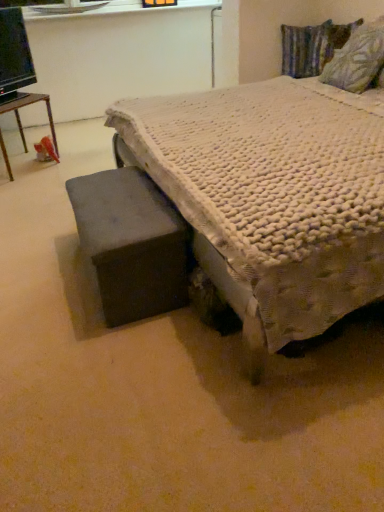
Measure the distance between point (145, 228) and camera.

They are 1.61 meters apart.

Describe the element at coordinates (357, 59) in the screenshot. I see `textured fabric pillow at upper right, the 1th pillow in the front-to-back sequence` at that location.

What do you see at coordinates (272, 197) in the screenshot?
I see `white textured bed at center` at bounding box center [272, 197].

What do you see at coordinates (306, 49) in the screenshot? Image resolution: width=384 pixels, height=512 pixels. I see `textured multicolored pillow at upper right, the first pillow positioned from the back` at bounding box center [306, 49].

Find the location of a particular element. This screenshot has height=512, width=384. dark gray fabric ottoman at lower left is located at coordinates (131, 243).

Based on the photo, considering the relative sizes of white textured bed at center and textured fabric pillow at upper right, the 1th pillow from the bottom, in the image provided, is white textured bed at center thinner than textured fabric pillow at upper right, the 1th pillow from the bottom,?

No.

Considering the points (170, 170) and (358, 83), which point is in front, point (170, 170) or point (358, 83)?

The point (170, 170) is closer to the camera.

Based on the photo, is white textured bed at center in contact with textured fabric pillow at upper right, the second pillow viewed from the back?

There is a gap between white textured bed at center and textured fabric pillow at upper right, the second pillow viewed from the back.

From the picture: From the image's perspective, which one is positioned lower, dark gray fabric ottoman at lower left or textured fabric pillow at upper right, the second pillow viewed from the back?

dark gray fabric ottoman at lower left.

Are dark gray fabric ottoman at lower left and textured fabric pillow at upper right, arranged as the 2th pillow when viewed from the top, located far from each other?

Indeed, dark gray fabric ottoman at lower left is not near textured fabric pillow at upper right, arranged as the 2th pillow when viewed from the top.

Image resolution: width=384 pixels, height=512 pixels. Identify the location of swivel chair below the textured fabric pillow at upper right, the 1th pillow from the bottom (from a real-world perspective). [x=131, y=243].

From a real-world perspective, who is located lower, dark gray fabric ottoman at lower left or textured fabric pillow at upper right, the 1th pillow in the front-to-back sequence?

dark gray fabric ottoman at lower left, from a real-world perspective.

How many degrees apart are the facing directions of black glossy computer monitor at upper left and textured multicolored pillow at upper right, the 2th pillow positioned from the front?

They differ by 58.6 degrees in their facing directions.

In the scene shown: From a real-world perspective, which object stands above the other?

In real-world perspective, black glossy computer monitor at upper left is above.

Which is behind, black glossy computer monitor at upper left or textured multicolored pillow at upper right, the first pillow positioned from the back?

textured multicolored pillow at upper right, the first pillow positioned from the back, is further from the camera.

Looking at this image, how far apart are black glossy computer monitor at upper left and textured multicolored pillow at upper right, the first pillow positioned from the back?

black glossy computer monitor at upper left is 2.20 meters from textured multicolored pillow at upper right, the first pillow positioned from the back.

Is there a large distance between textured fabric pillow at upper right, the second pillow viewed from the back, and black glossy computer monitor at upper left?

Absolutely, textured fabric pillow at upper right, the second pillow viewed from the back, is distant from black glossy computer monitor at upper left.

Which object is closer to the camera taking this photo, textured fabric pillow at upper right, arranged as the 2th pillow when viewed from the top, or black glossy computer monitor at upper left?

textured fabric pillow at upper right, arranged as the 2th pillow when viewed from the top, is closer to the camera.

From the image's perspective, is textured fabric pillow at upper right, arranged as the 2th pillow when viewed from the top, under black glossy computer monitor at upper left?

Indeed, from the image's perspective, textured fabric pillow at upper right, arranged as the 2th pillow when viewed from the top, is shown beneath black glossy computer monitor at upper left.

Which is more to the left, textured multicolored pillow at upper right, the 2th pillow positioned from the front, or textured fabric pillow at upper right, arranged as the 2th pillow when viewed from the top?

Positioned to the left is textured multicolored pillow at upper right, the 2th pillow positioned from the front.

Looking at this image, between textured multicolored pillow at upper right, the first pillow in the top-to-bottom sequence, and textured fabric pillow at upper right, the second pillow viewed from the back, which one is positioned in front?

textured fabric pillow at upper right, the second pillow viewed from the back.

Considering the sizes of objects textured multicolored pillow at upper right, the 2th pillow positioned from the front, and textured fabric pillow at upper right, the 1th pillow in the front-to-back sequence, in the image provided, who is bigger, textured multicolored pillow at upper right, the 2th pillow positioned from the front, or textured fabric pillow at upper right, the 1th pillow in the front-to-back sequence,?

With larger size is textured fabric pillow at upper right, the 1th pillow in the front-to-back sequence.

Is textured multicolored pillow at upper right, the first pillow positioned from the back, next to textured fabric pillow at upper right, arranged as the 2th pillow when viewed from the top?

No, textured multicolored pillow at upper right, the first pillow positioned from the back, is not with textured fabric pillow at upper right, arranged as the 2th pillow when viewed from the top.

Can you confirm if dark gray fabric ottoman at lower left is wider than white textured bed at center?

Incorrect, the width of dark gray fabric ottoman at lower left does not surpass that of white textured bed at center.

From the image's perspective, is dark gray fabric ottoman at lower left on top of white textured bed at center?

No, from the image's perspective, dark gray fabric ottoman at lower left is not above white textured bed at center.

Looking at this image, could you tell me if dark gray fabric ottoman at lower left is facing white textured bed at center?

No, dark gray fabric ottoman at lower left is not oriented towards white textured bed at center.

Is point (382, 17) behind point (23, 146)?

No, it is in front of (23, 146).

From a real-world perspective, which object rests below the other?

From a 3D spatial view, wooden table at left is below.

Looking at this image, is textured fabric pillow at upper right, the second pillow viewed from the back, wider or thinner than wooden table at left?

In the image, textured fabric pillow at upper right, the second pillow viewed from the back, appears to be more narrow than wooden table at left.

Looking at this image, does textured fabric pillow at upper right, the 1th pillow in the front-to-back sequence, lie in front of wooden table at left?

Yes, the depth of textured fabric pillow at upper right, the 1th pillow in the front-to-back sequence, is less than that of wooden table at left.

This screenshot has height=512, width=384. What are the coordinates of `pillow that is the 1st one when counting backward from the white textured bed at center` in the screenshot? It's located at (357, 59).

The image size is (384, 512). In order to click on the 2nd pillow to the right of the dark gray fabric ottoman at lower left, counting from the anchor's position in this screenshot , I will do `click(357, 59)`.

In the scene shown: Based on their spatial positions, is textured multicolored pillow at upper right, the 2th pillow positioned from the front, or textured fabric pillow at upper right, the 1th pillow from the bottom, further from wooden table at left?

Among the two, textured fabric pillow at upper right, the 1th pillow from the bottom, is located further to wooden table at left.

Which object lies nearer to the anchor point black glossy computer monitor at upper left, textured multicolored pillow at upper right, the first pillow positioned from the back, or textured fabric pillow at upper right, the 1th pillow from the bottom?

Based on the image, textured multicolored pillow at upper right, the first pillow positioned from the back, appears to be nearer to black glossy computer monitor at upper left.

Which object lies nearer to the anchor point black glossy computer monitor at upper left, dark gray fabric ottoman at lower left or textured fabric pillow at upper right, the second pillow viewed from the back?

The object closer to black glossy computer monitor at upper left is dark gray fabric ottoman at lower left.

Estimate the real-world distances between objects in this image. Which object is further from black glossy computer monitor at upper left, textured fabric pillow at upper right, the 1th pillow in the front-to-back sequence, or wooden table at left?

textured fabric pillow at upper right, the 1th pillow in the front-to-back sequence, is further to black glossy computer monitor at upper left.

Looking at the image, which one is located closer to textured fabric pillow at upper right, arranged as the 2th pillow when viewed from the top, white textured bed at center or textured multicolored pillow at upper right, the 2th pillow in the bottom-to-top sequence?

white textured bed at center lies closer to textured fabric pillow at upper right, arranged as the 2th pillow when viewed from the top, than the other object.

Which object lies nearer to the anchor point dark gray fabric ottoman at lower left, textured multicolored pillow at upper right, the 2th pillow in the bottom-to-top sequence, or black glossy computer monitor at upper left?

black glossy computer monitor at upper left is closer to dark gray fabric ottoman at lower left.

From the image, which object appears to be nearer to black glossy computer monitor at upper left, textured fabric pillow at upper right, the 1th pillow in the front-to-back sequence, or dark gray fabric ottoman at lower left?

dark gray fabric ottoman at lower left lies closer to black glossy computer monitor at upper left than the other object.

Based on their spatial positions, is dark gray fabric ottoman at lower left or white textured bed at center further from black glossy computer monitor at upper left?

white textured bed at center is further to black glossy computer monitor at upper left.

Find the location of `swivel chair between wooden table at left and textured fabric pillow at upper right, the 1th pillow from the bottom, in the horizontal direction`. swivel chair between wooden table at left and textured fabric pillow at upper right, the 1th pillow from the bottom, in the horizontal direction is located at coordinates (131, 243).

Where is `computer monitor located between wooden table at left and white textured bed at center in the left-right direction`? The width and height of the screenshot is (384, 512). computer monitor located between wooden table at left and white textured bed at center in the left-right direction is located at coordinates (14, 54).

Where is `computer monitor between wooden table at left and textured multicolored pillow at upper right, the 2th pillow positioned from the front, in the horizontal direction`? computer monitor between wooden table at left and textured multicolored pillow at upper right, the 2th pillow positioned from the front, in the horizontal direction is located at coordinates (14, 54).

The image size is (384, 512). I want to click on computer monitor positioned between dark gray fabric ottoman at lower left and wooden table at left from near to far, so click(x=14, y=54).